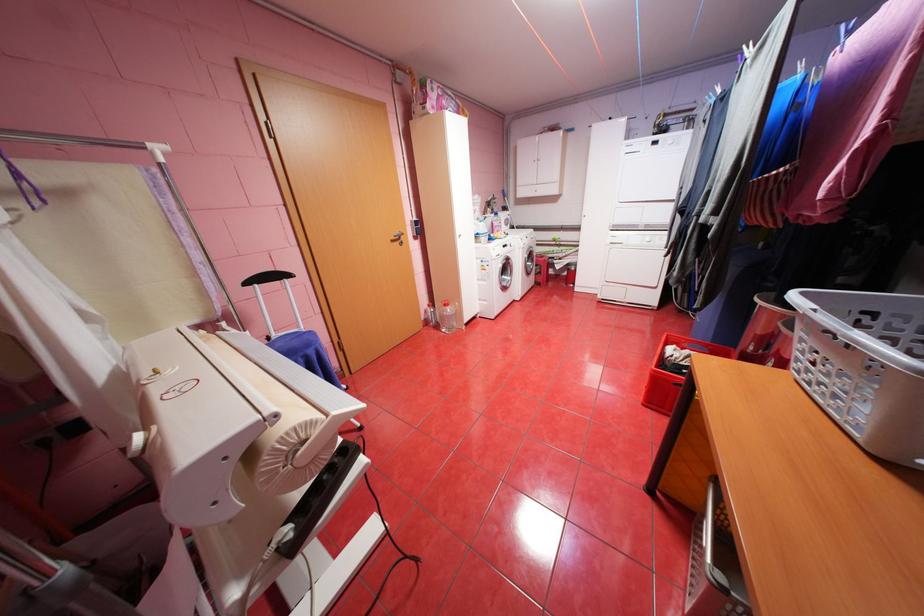
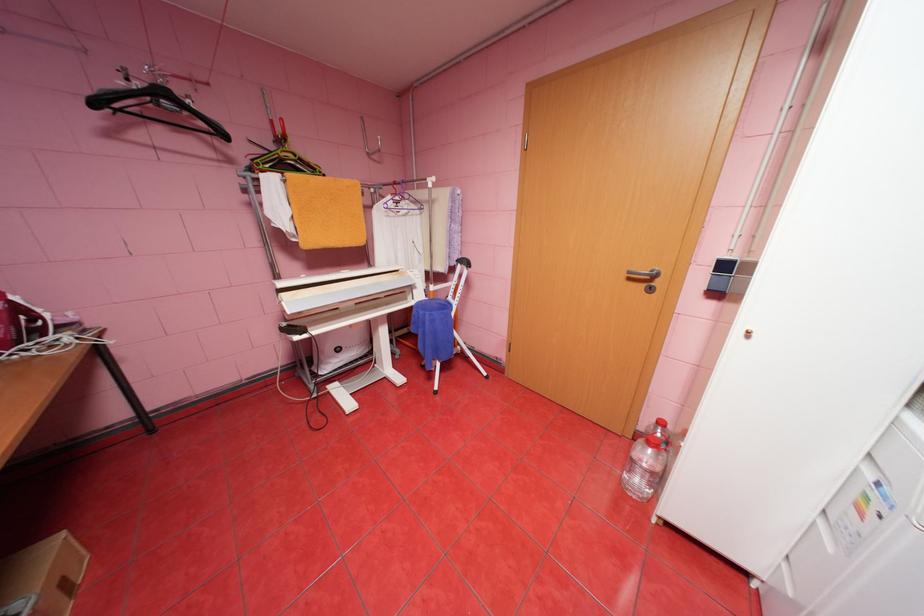
In the second image, find the point that corresponds to point 456,308 in the first image.

(659, 451)